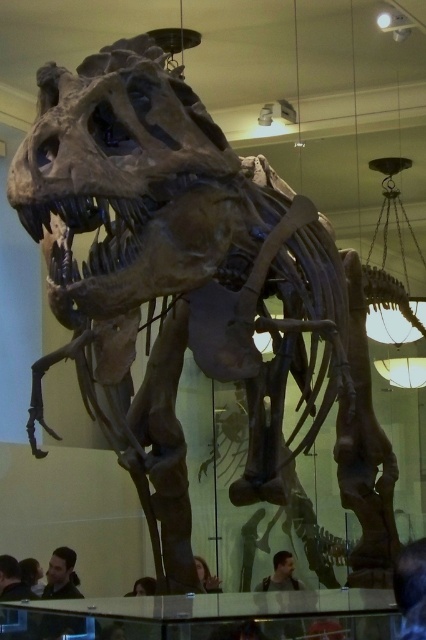
You are a visitor standing in front of the T. rex skeleton. You notice two people in the scene. One has dark hair at lower right and the other wears a dark brown leather jacket at lower center. Which person is closer to the glass barrier protecting the T. rex exhibit?

The dark hair at lower right is to the right of dark brown leather jacket at lower center, so the dark brown leather jacket at lower center is closer to the glass barrier since it is positioned more towards the center near the exhibit.

You are a tour guide standing at the camera position. You notice a visitor with dark brown hair at lower left who is 5 feet 7 inches tall. Can this visitor see the entire T. rex skeleton without moving their head?

The dark brown hair at lower left is 16.83 feet away from the camera. Since the visitor is 5 feet 7 inches tall, they would likely be able to see the entire T. rex skeleton from that distance without needing to move their head, as the T. rex is mounted on a platform with its head at the top left, and the skeleton is displayed prominently in the museum setting.

You are standing in front of the T. rex skeleton and notice a point marked at coordinates (411, 588). What is located at that point?

The point at coordinates (411, 588) marks dark hair at lower right.